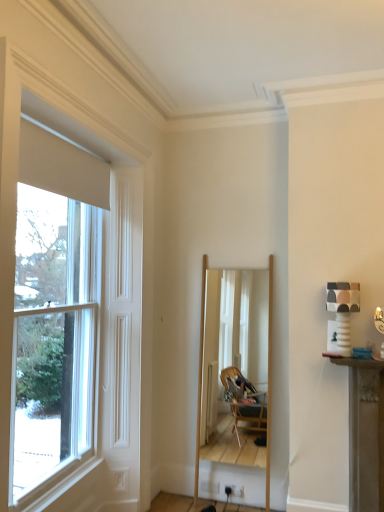
Describe the element at coordinates (235, 331) in the screenshot. The image size is (384, 512). I see `wooden mirror at center` at that location.

What are the coordinates of `wooden mirror at center` in the screenshot? It's located at (235, 331).

The width and height of the screenshot is (384, 512). Describe the element at coordinates (75, 326) in the screenshot. I see `white glossy window at left` at that location.

Where is `white glossy window at left`? Image resolution: width=384 pixels, height=512 pixels. white glossy window at left is located at coordinates (75, 326).

Measure the distance between white glossy window at left and camera.

white glossy window at left is 1.77 meters from camera.

Locate an element on the screen. The width and height of the screenshot is (384, 512). wooden mirror at center is located at coordinates (235, 331).

Considering the positions of objects white glossy window at left and wooden mirror at center in the image provided, who is more to the left, white glossy window at left or wooden mirror at center?

From the viewer's perspective, white glossy window at left appears more on the left side.

Is white glossy window at left in front of wooden mirror at center?

Yes, white glossy window at left is closer to the camera.

Is point (130, 347) closer to camera compared to point (229, 426)?

Yes.

From the image's perspective, which one is positioned higher, white glossy window at left or wooden mirror at center?

white glossy window at left is shown above in the image.

From a real-world perspective, which is physically above, white glossy window at left or wooden mirror at center?

In real-world perspective, white glossy window at left is above.

Considering the relative sizes of white glossy window at left and wooden mirror at center in the image provided, is white glossy window at left thinner than wooden mirror at center?

Yes.

Can you confirm if white glossy window at left is shorter than wooden mirror at center?

No, white glossy window at left is not shorter than wooden mirror at center.

Looking at the image, does white glossy window at left seem bigger or smaller compared to wooden mirror at center?

white glossy window at left is bigger than wooden mirror at center.

Do you think white glossy window at left is within wooden mirror at center, or outside of it?

white glossy window at left is outside wooden mirror at center.

Would you consider white glossy window at left to be distant from wooden mirror at center?

Indeed, white glossy window at left is not near wooden mirror at center.

Is white glossy window at left positioned with its back to wooden mirror at center?

No, white glossy window at left's orientation is not away from wooden mirror at center.

The height and width of the screenshot is (512, 384). Identify the location of window that is on the left side of wooden mirror at center. (75, 326).

Which object is positioned more to the left, wooden mirror at center or white glossy window at left?

white glossy window at left is more to the left.

Is the position of wooden mirror at center less distant than that of white glossy window at left?

No, it is behind white glossy window at left.

Is point (256, 359) positioned in front of point (34, 210)?

No, it is behind (34, 210).

From the image's perspective, which one is positioned higher, wooden mirror at center or white glossy window at left?

white glossy window at left appears higher in the image.

From a real-world perspective, which object rests below the other?

wooden mirror at center is physically lower.

Considering the sizes of objects wooden mirror at center and white glossy window at left in the image provided, who is thinner, wooden mirror at center or white glossy window at left?

white glossy window at left is thinner.

In terms of height, does wooden mirror at center look taller or shorter compared to white glossy window at left?

Considering their sizes, wooden mirror at center has less height than white glossy window at left.

In the scene shown: Considering the relative sizes of wooden mirror at center and white glossy window at left in the image provided, is wooden mirror at center smaller than white glossy window at left?

Correct, wooden mirror at center occupies less space than white glossy window at left.

Can we say wooden mirror at center lies outside white glossy window at left?

Yes.

Would you consider wooden mirror at center to be distant from white glossy window at left?

That's right, there is a large distance between wooden mirror at center and white glossy window at left.

In the scene shown: Does wooden mirror at center turn towards white glossy window at left?

No, wooden mirror at center is not oriented towards white glossy window at left.

How many degrees apart are the facing directions of wooden mirror at center and white glossy window at left?

88.2 degrees separate the facing orientations of wooden mirror at center and white glossy window at left.

Locate an element on the screen. The width and height of the screenshot is (384, 512). window located in front of the wooden mirror at center is located at coordinates (75, 326).

Find the location of a particular element. The image size is (384, 512). window that is in front of the wooden mirror at center is located at coordinates (75, 326).

The image size is (384, 512). I want to click on window on the left of wooden mirror at center, so pyautogui.click(x=75, y=326).